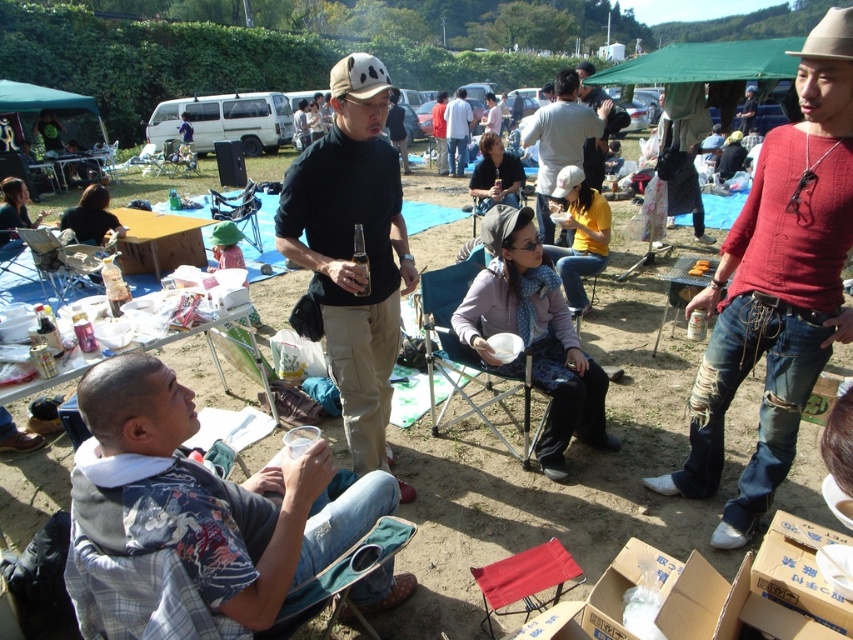
Between blue fabric chair at center and matte black jacket at center, which one is positioned higher?

matte black jacket at center is above.

Is blue fabric chair at center above matte black jacket at center?

Actually, blue fabric chair at center is below matte black jacket at center.

The image size is (853, 640). Find the location of `blue fabric chair at center`. blue fabric chair at center is located at coordinates (463, 355).

In the scene shown: Which is more to the left, ripped denim jeans at center or blue fabric chair at center?

blue fabric chair at center

Between point (671, 492) and point (431, 365), which one is positioned behind?

Positioned behind is point (431, 365).

You are a GUI agent. You are given a task and a screenshot of the screen. Output one action in this format:
    pyautogui.click(x=<x>, y=<y>)
    Task: Click on the ripped denim jeans at center
    This screenshot has height=640, width=853.
    Given the screenshot: What is the action you would take?
    pyautogui.click(x=776, y=285)

Which is more to the right, printed cotton shirt at lower left or matte black folding chair at center?

From the viewer's perspective, printed cotton shirt at lower left appears more on the right side.

Is printed cotton shirt at lower left smaller than matte black folding chair at center?

Incorrect, printed cotton shirt at lower left is not smaller in size than matte black folding chair at center.

Is point (149, 380) more distant than point (248, 214)?

No, (149, 380) is closer to viewer.

Where is `printed cotton shirt at lower left`? This screenshot has width=853, height=640. printed cotton shirt at lower left is located at coordinates (207, 496).